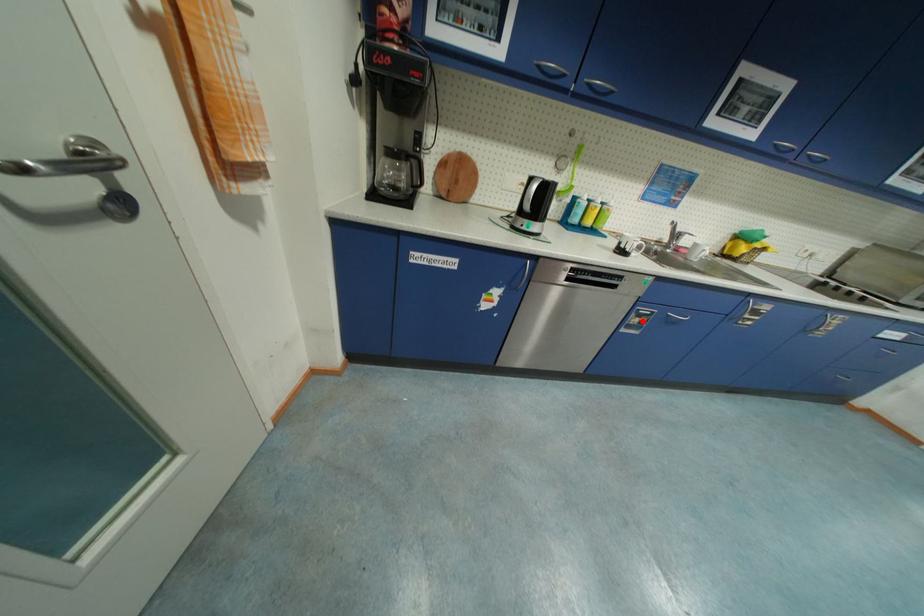
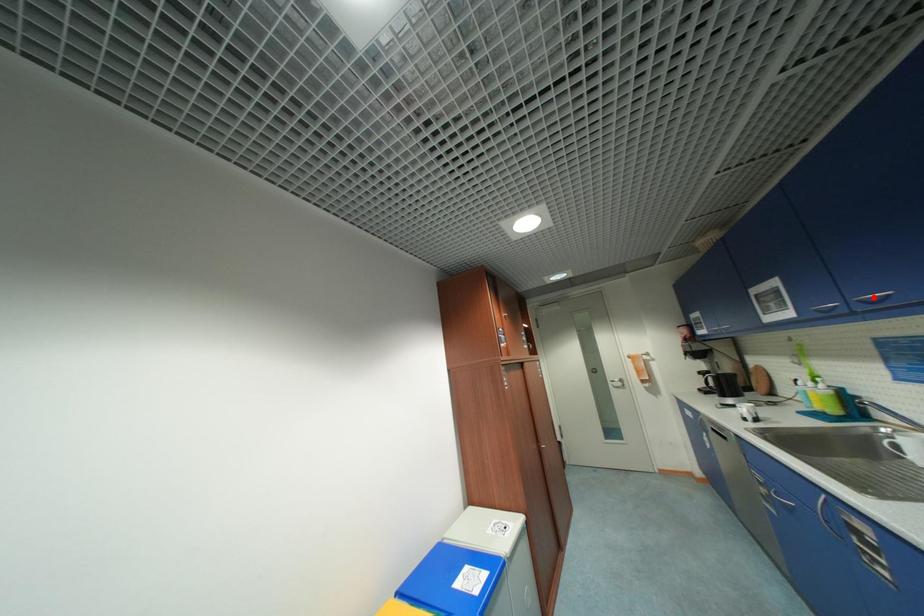
I am providing you with two images of the same scene from different viewpoints. A red point is marked on the first image and another point is marked on the second image. Does the point marked in image1 correspond to the same location as the one in image2?

No